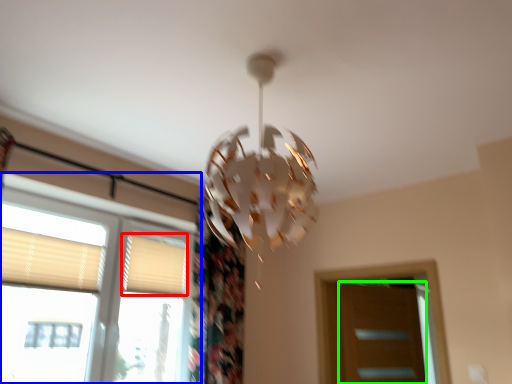
Question: Estimate the real-world distances between objects in this image. Which object is farther from shutter (highlighted by a red box), window (highlighted by a blue box) or screen door (highlighted by a green box)?

Choices:
 (A) window
 (B) screen door

Answer: (B)